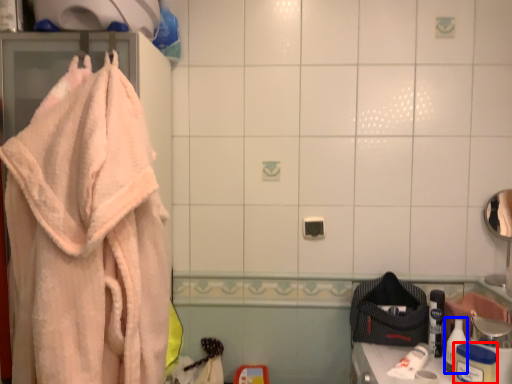
Question: Which object appears farthest to the camera in this image, toiletry (highlighted by a red box) or toiletry (highlighted by a blue box)?

Choices:
 (A) toiletry
 (B) toiletry

Answer: (B)